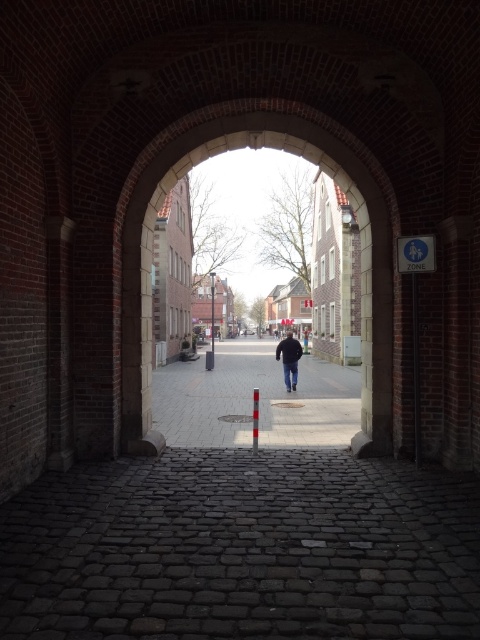
Can you confirm if brick tunnel at center is positioned to the left of dark blue jeans at center?

Yes, brick tunnel at center is to the left of dark blue jeans at center.

Can you confirm if brick tunnel at center is positioned to the right of dark blue jeans at center?

Incorrect, brick tunnel at center is not on the right side of dark blue jeans at center.

Is point (303, 154) farther from viewer compared to point (290, 387)?

No, (303, 154) is in front of (290, 387).

This screenshot has width=480, height=640. Identify the location of brick tunnel at center. (360, 262).

Who is higher up, smooth stone pavement at center or dark blue jeans at center?

Positioned higher is dark blue jeans at center.

Does smooth stone pavement at center come behind dark blue jeans at center?

No, it is not.

Does point (159, 412) come closer to viewer compared to point (286, 340)?

Yes, point (159, 412) is in front of point (286, 340).

Identify the location of smooth stone pavement at center. (252, 397).

Does brick tunnel at center lie behind smooth stone pavement at center?

No.

Can you confirm if brick tunnel at center is wider than smooth stone pavement at center?

In fact, brick tunnel at center might be narrower than smooth stone pavement at center.

Does point (389, 374) lie in front of point (311, 406)?

Yes, it is in front of point (311, 406).

At what (x,y) coordinates should I click in order to perform the action: click on brick tunnel at center. Please return your answer as a coordinate pair (x, y). The image size is (480, 640). Looking at the image, I should click on (360, 262).